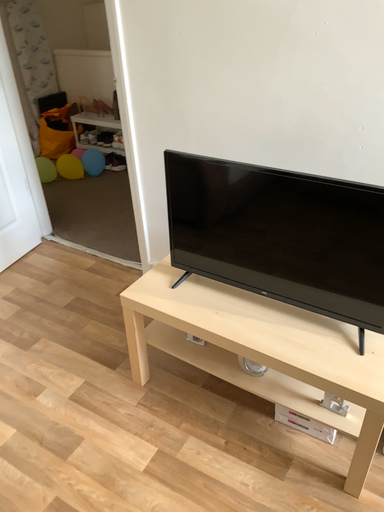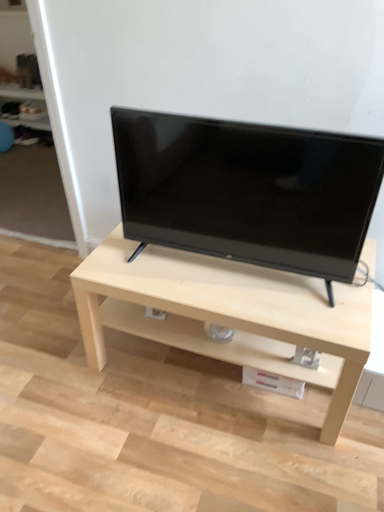
Question: Which way did the camera rotate in the video?

Choices:
 (A) rotated left
 (B) rotated right

Answer: (B)